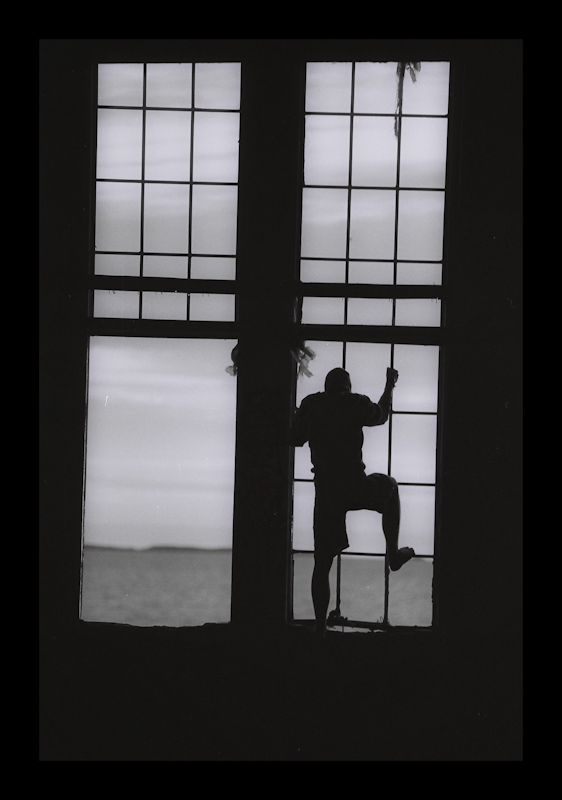
Locate an element on the screen. This screenshot has height=800, width=562. upper left window is located at coordinates (178, 197).